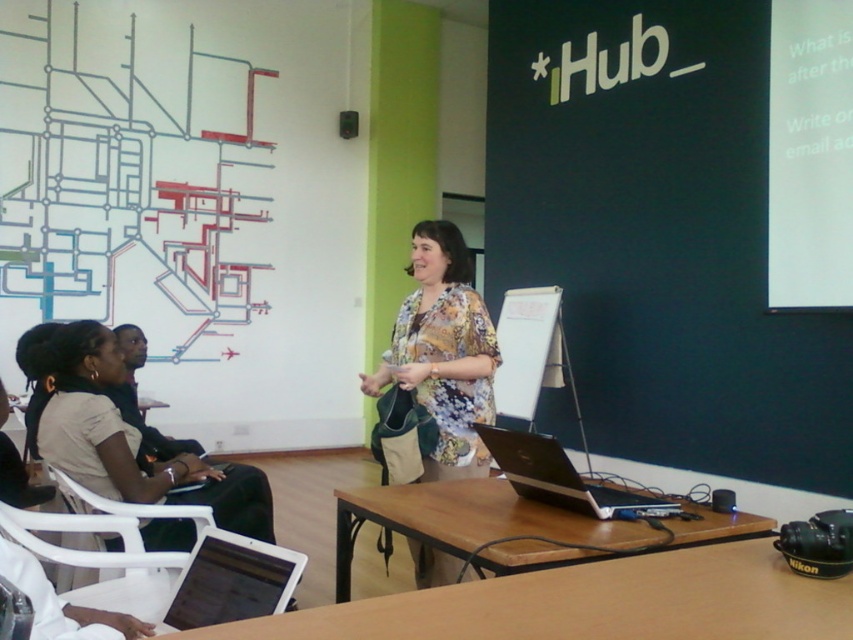
You are standing at the point marked as point [437,376] in the image. If you want to take a photo of the presenter at the wooden table, will you be able to capture her clearly without moving from your current position?

The distance between you at point [437,376] and the camera is 2.59 meters. Since the presenter is at the wooden table, which is likely within this distance, you should be able to capture her clearly without moving.